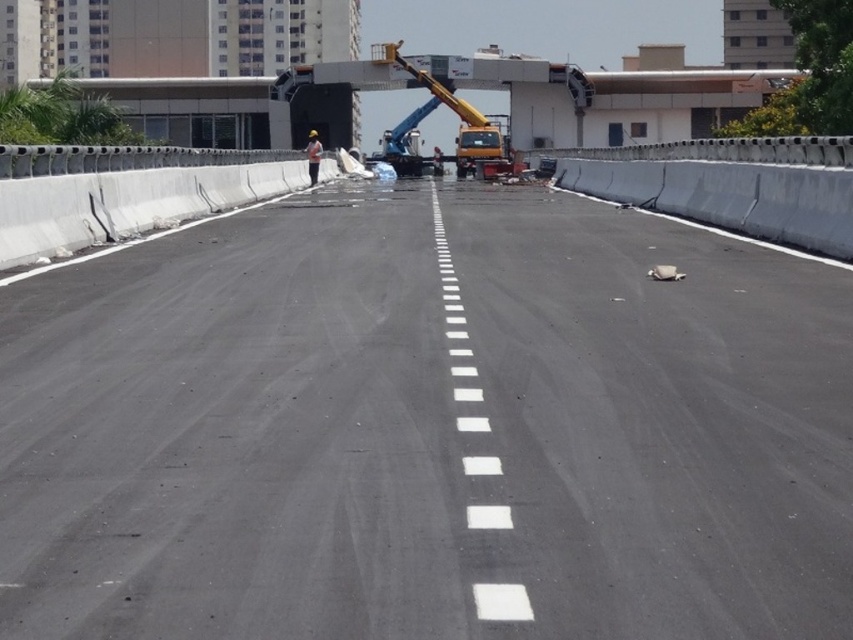
Looking at this image, you are standing on the newly paved road and want to reach the point marked at coordinates point (775, 630). If your walking speed is 1.5 meters per second, how long will it take you to reach that point?

The point (775, 630) is 4.27 meters away from the viewer. At a walking speed of 1.5 meters per second, it will take approximately 2.85 seconds to reach the point.

You are a construction worker standing at the edge of the road. You need to move from your current position to the yellow metallic crane at center. Which direction should you move relative to the white reflective vest at center?

The yellow metallic crane at center is to the right of the white reflective vest at center, so you should move to the right of the white reflective vest at center to reach it.

You are a delivery driver who needs to cross the black asphalt highway at center while avoiding the white reflective vest at center. Which object should you prioritize avoiding and why?

You should prioritize avoiding the white reflective vest at center because it is larger than the black asphalt highway at center, indicating it might be an obstacle or a safety indicator that you need to bypass.